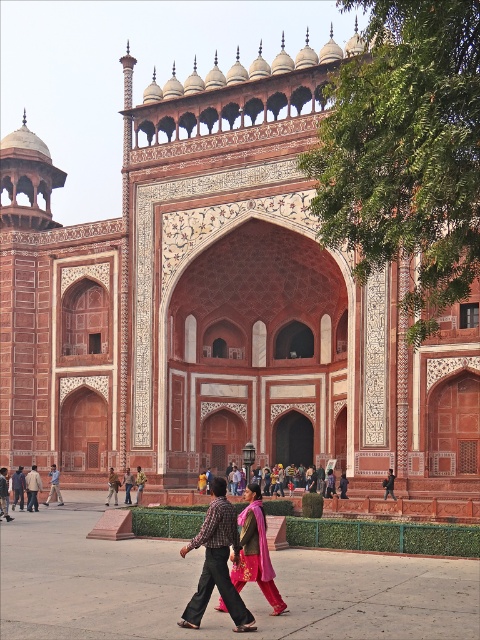
Is pink fabric saree at center taller than matte brown pants at center?

Yes.

Does point (230, 556) come behind point (109, 472)?

That is False.

Find the location of a particular element. The width and height of the screenshot is (480, 640). pink fabric saree at center is located at coordinates (255, 552).

Between matte brown pants at center and light brown leather jacket at lower left, which one appears on the left side from the viewer's perspective?

From the viewer's perspective, light brown leather jacket at lower left appears more on the left side.

Is matte brown pants at center to the left of light brown leather jacket at lower left from the viewer's perspective?

Incorrect, matte brown pants at center is not on the left side of light brown leather jacket at lower left.

Who is more distant from viewer, (126, 496) or (41, 488)?

The point (41, 488) is behind.

Find the location of `matte brown pants at center`. matte brown pants at center is located at coordinates (132, 484).

Is pink fabric saree at center further to the viewer compared to light brown leather jacket at lower left?

No, pink fabric saree at center is closer to the viewer.

Does pink fabric saree at center have a smaller size compared to light brown leather jacket at lower left?

Correct, pink fabric saree at center occupies less space than light brown leather jacket at lower left.

The height and width of the screenshot is (640, 480). Describe the element at coordinates (255, 552) in the screenshot. I see `pink fabric saree at center` at that location.

Locate an element on the screen. pink fabric saree at center is located at coordinates (255, 552).